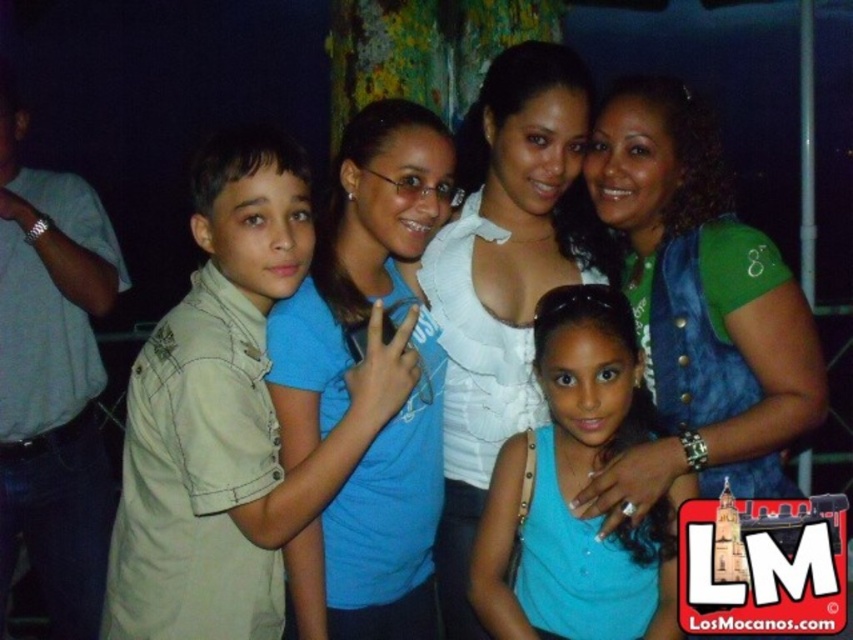
Is blue cotton shirt at center closer to the viewer compared to matte blue tank top at center?

Yes.

Is blue cotton shirt at center above matte blue tank top at center?

Yes.

Is point (334, 339) behind point (581, 436)?

That is False.

You are a GUI agent. You are given a task and a screenshot of the screen. Output one action in this format:
    pyautogui.click(x=<x>, y=<y>)
    Task: Click on the blue cotton shirt at center
    The image size is (853, 640).
    Given the screenshot: What is the action you would take?
    point(357,260)

Which of these two, green denim vest at upper right or matte blue tank top at center, stands taller?

green denim vest at upper right is taller.

Is point (633, 84) farther from viewer compared to point (612, 598)?

Yes, point (633, 84) is farther from viewer.

This screenshot has width=853, height=640. I want to click on green denim vest at upper right, so click(697, 307).

Measure the distance between point (511, 170) and camera.

A distance of 2.38 meters exists between point (511, 170) and camera.

Between white ruffled blouse at center and matte blue tank top at center, which one appears on the right side from the viewer's perspective?

Positioned to the right is matte blue tank top at center.

Between point (485, 339) and point (503, 561), which one is positioned in front?

Positioned in front is point (503, 561).

Identify the location of white ruffled blouse at center. (505, 278).